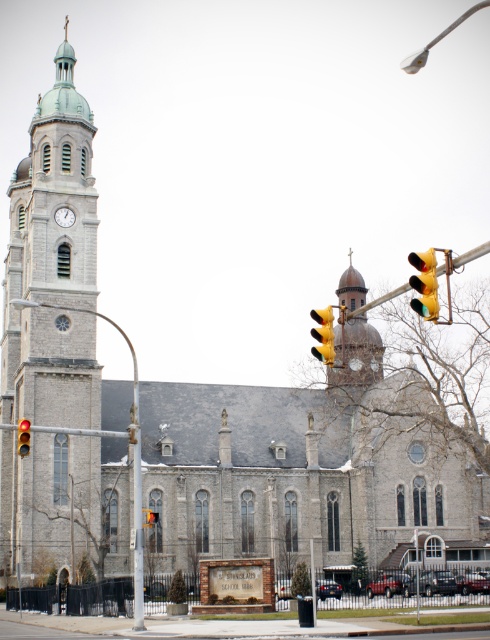
Who is more forward, (343, 348) or (60, 224)?

Point (60, 224) is in front.

Which is behind, point (336, 348) or point (71, 212)?

Positioned behind is point (336, 348).

Locate an element on the screen. The height and width of the screenshot is (640, 490). brown stone clock tower at center is located at coordinates (356, 353).

Is yellow matte traffic light at upper right below red glass traffic light at upper right?

Incorrect, yellow matte traffic light at upper right is not positioned below red glass traffic light at upper right.

Is yellow matte traffic light at upper right bigger than red glass traffic light at upper right?

Correct, yellow matte traffic light at upper right is larger in size than red glass traffic light at upper right.

Describe the element at coordinates (424, 284) in the screenshot. I see `yellow matte traffic light at upper right` at that location.

Find the location of a particular element. This screenshot has width=490, height=640. yellow matte traffic light at upper right is located at coordinates (424, 284).

Does yellow matte traffic light at center have a lesser height compared to red glass traffic light at upper right?

No, yellow matte traffic light at center is not shorter than red glass traffic light at upper right.

Can you confirm if yellow matte traffic light at center is positioned to the right of red glass traffic light at upper right?

Indeed, yellow matte traffic light at center is positioned on the right side of red glass traffic light at upper right.

Find the location of a particular element. The width and height of the screenshot is (490, 640). yellow matte traffic light at center is located at coordinates (322, 333).

Identify the location of yellow matte traffic light at center. This screenshot has width=490, height=640. (322, 333).